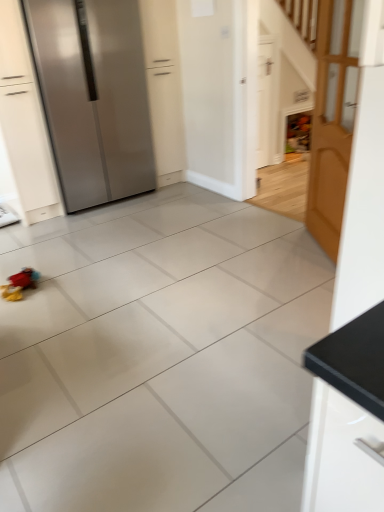
Question: Relative to satin silver refrigerator at left, is wooden door at right, the 1th door viewed from the front, in front or behind?

Choices:
 (A) behind
 (B) front

Answer: (B)

Question: Considering the positions of point (342, 31) and point (54, 67), is point (342, 31) closer or farther from the camera than point (54, 67)?

Choices:
 (A) closer
 (B) farther

Answer: (A)

Question: Which object is the farthest from the satin silver refrigerator at left?

Choices:
 (A) white matte door at upper right, which is the second door in front-to-back order
 (B) wooden door at right, the second door in the back-to-front sequence
 (C) plush multicolored toy at lower left

Answer: (B)

Question: Which object is the closest to the plush multicolored toy at lower left?

Choices:
 (A) satin silver refrigerator at left
 (B) wooden door at right, the 1th door viewed from the front
 (C) white matte door at upper right, which is the second door in front-to-back order

Answer: (A)